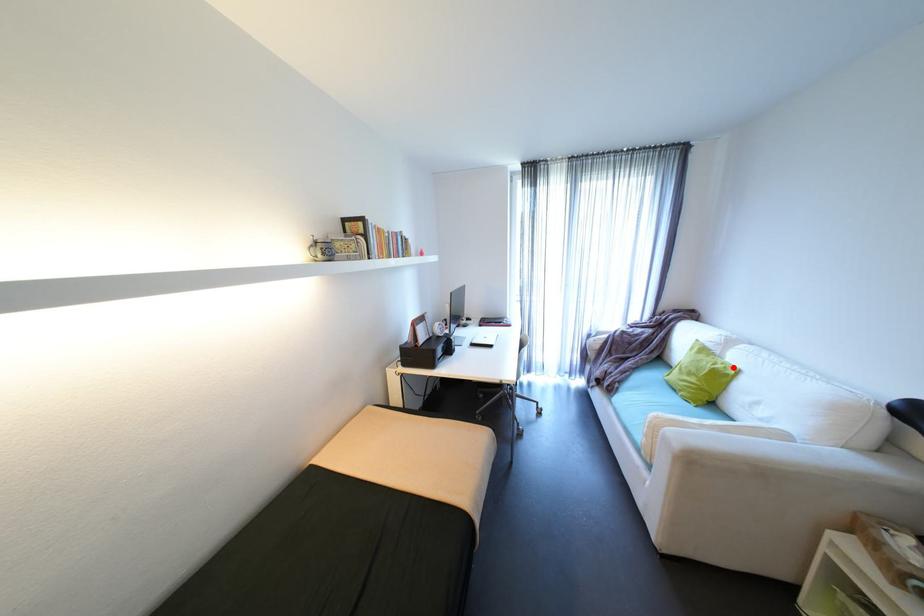
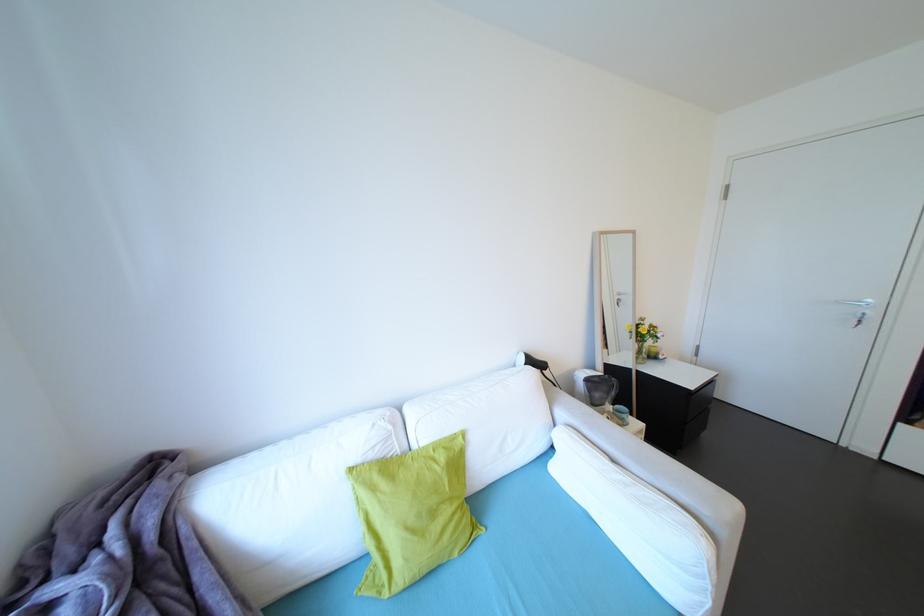
Find the pixel in the second image that matches the highlighted location in the first image.

(451, 448)